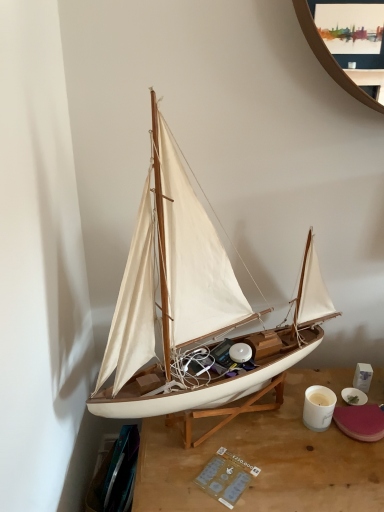
Image resolution: width=384 pixels, height=512 pixels. Identify the location of blank space to the left of white glossy coffee cup at lower right. (259, 432).